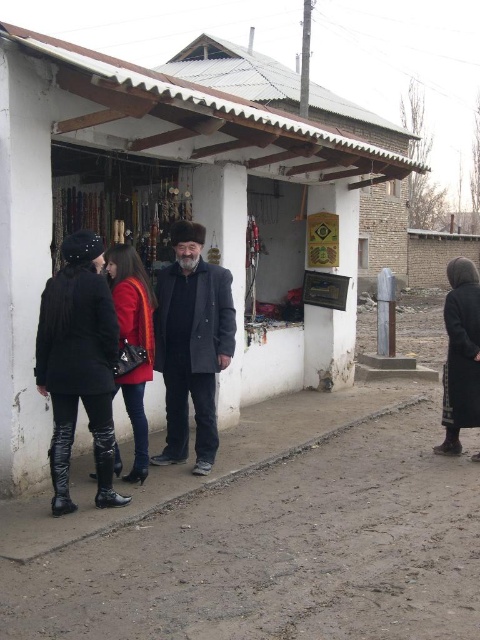
Question: Which object appears closest to the camera in this image?

Choices:
 (A) dark gray wool coat at right
 (B) black leather boots at lower left

Answer: (B)

Question: Can you confirm if white matte hut at center is bigger than dark gray wool coat at right?

Choices:
 (A) no
 (B) yes

Answer: (B)

Question: Can you confirm if dark gray wool coat at center is wider than red leather boots at center?

Choices:
 (A) no
 (B) yes

Answer: (B)

Question: Which of the following is the closest to the observer?

Choices:
 (A) dark gray wool coat at right
 (B) white matte hut at center
 (C) red leather boots at center

Answer: (B)

Question: Which of the following is the closest to the observer?

Choices:
 (A) red leather boots at center
 (B) white matte hut at center
 (C) dark gray wool coat at right
 (D) black leather boots at lower left

Answer: (D)

Question: Can you confirm if white matte hut at center is smaller than black leather boots at lower left?

Choices:
 (A) no
 (B) yes

Answer: (A)